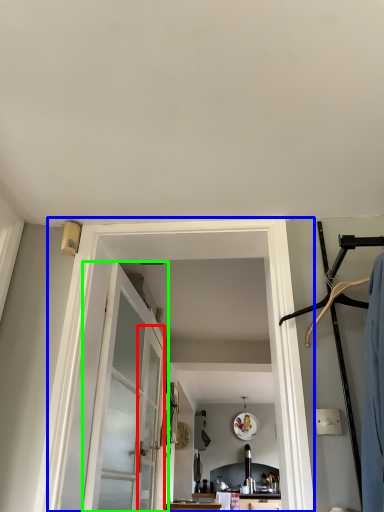
Question: Estimate the real-world distances between objects in this image. Which object is closer to screen door (highlighted by a red box), barn door (highlighted by a blue box) or door (highlighted by a green box)?

Choices:
 (A) barn door
 (B) door

Answer: (B)